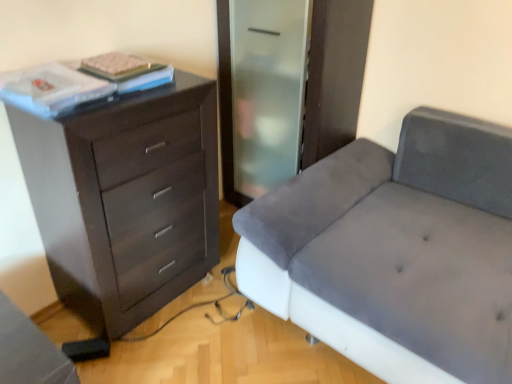
Question: Visually, is velvet grey couch at right positioned to the left or to the right of dark wood chest of drawers at left?

Choices:
 (A) left
 (B) right

Answer: (B)

Question: Looking at their shapes, would you say velvet grey couch at right is wider or thinner than dark wood chest of drawers at left?

Choices:
 (A) wide
 (B) thin

Answer: (A)

Question: Which is nearer to the dark wood chest of drawers at left?

Choices:
 (A) white matte book at upper left
 (B) velvet grey couch at right

Answer: (A)

Question: Based on their relative distances, which object is nearer to the dark wood chest of drawers at left?

Choices:
 (A) white matte book at upper left
 (B) velvet grey couch at right

Answer: (A)